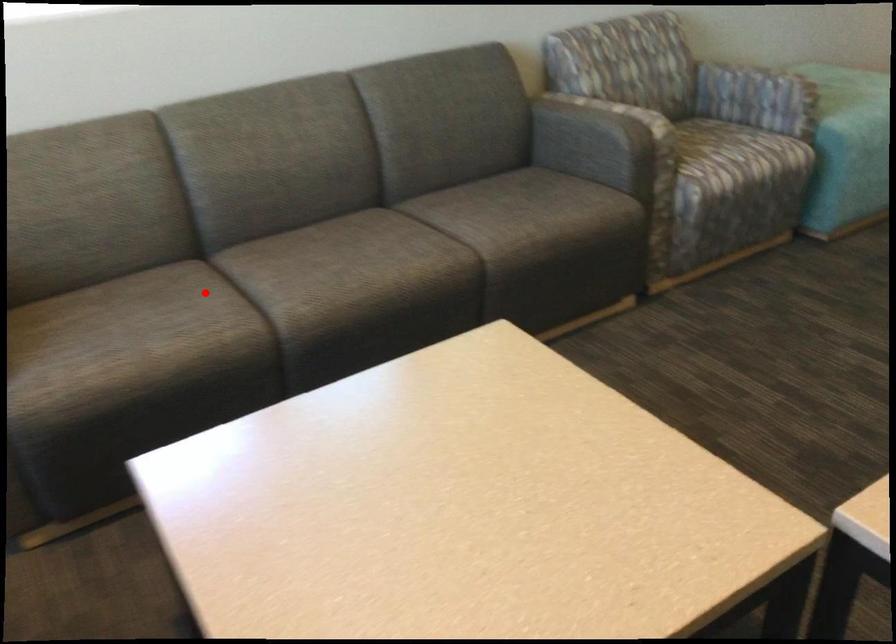
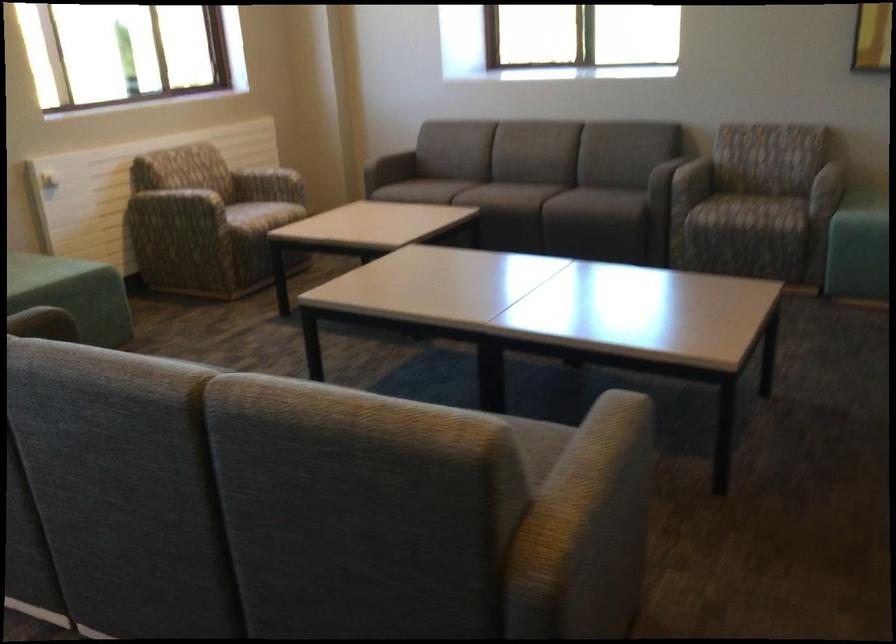
Locate, in the second image, the point that corresponds to the highlighted location in the first image.

(455, 187)